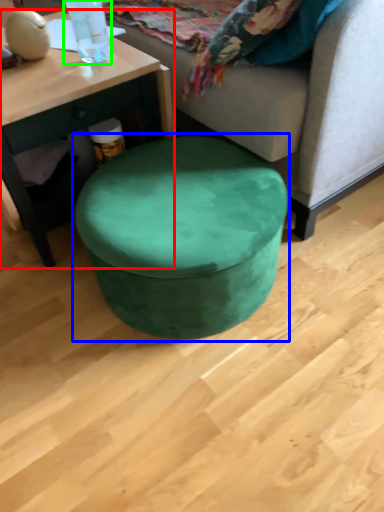
Question: Which object is the closest to the coffee table (highlighted by a red box)? Choose among these: music stool (highlighted by a blue box) or bottle (highlighted by a green box).

Choices:
 (A) music stool
 (B) bottle

Answer: (B)